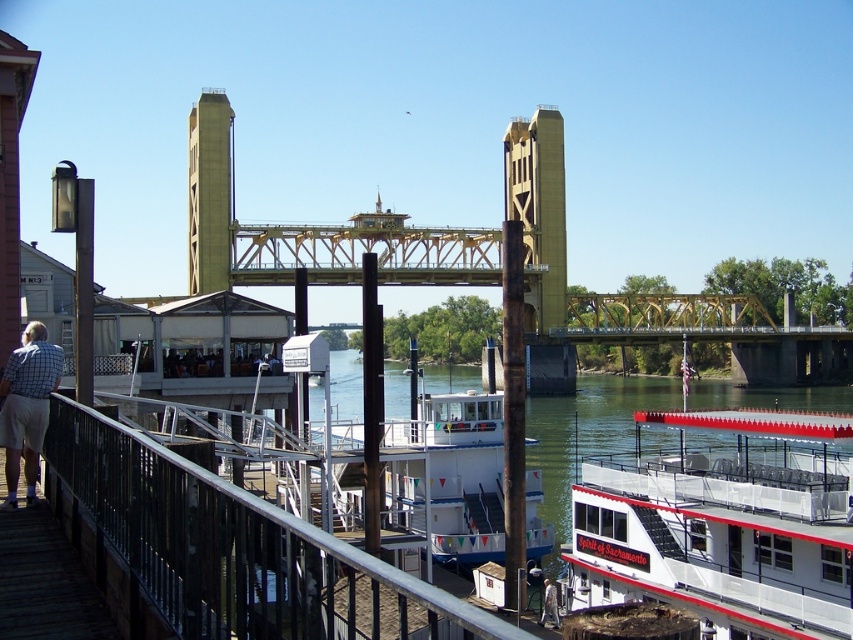
You are a photographer standing on the wooden dock with a checkered shirt at left. You want to take a photo of the white matte boat at center. Can you stand closer to the boat without any obstruction from your shirt?

The white matte boat at center is taller than the checkered shirt at left, so you can stand closer to the boat without the checkered shirt obstructing your view.

You are standing at the point labeled point (x=57, y=356) and want to walk to the point labeled point (x=456, y=436). Based on the scene description, will you have to go around any obstacles or can you walk straight towards your destination?

Since point (x=456, y=436) is behind point (x=57, y=356), you will need to walk straight towards your destination without needing to go around any obstacles.

You are a photographer standing at the riverside. You want to take a photo of the white matte boat at lower right without any people in the frame. Is the checkered shirt at left blocking your view of the boat?

The checkered shirt at left is behind the white matte boat at lower right, so it won not block your view of the boat.